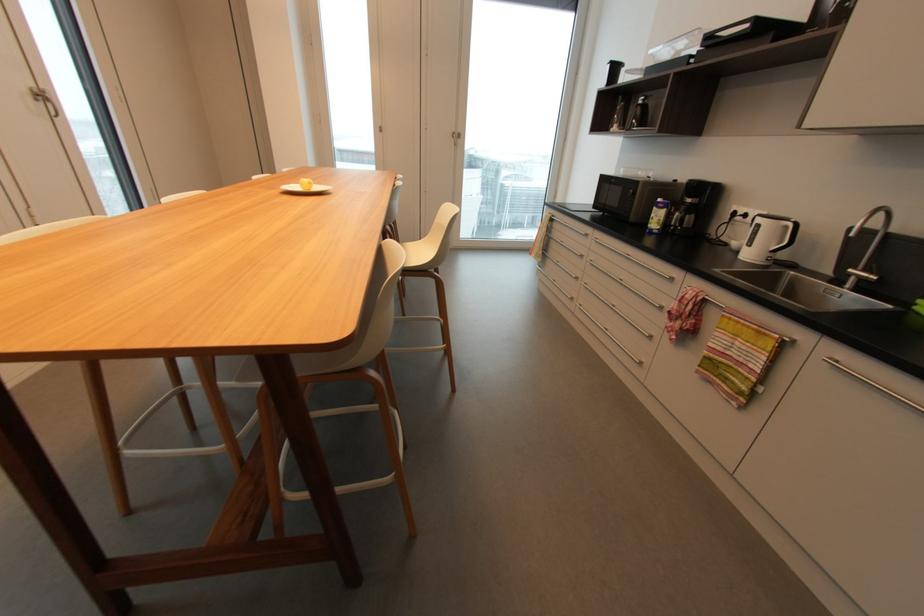
Where is `blue milk carton`? The width and height of the screenshot is (924, 616). blue milk carton is located at coordinates (658, 215).